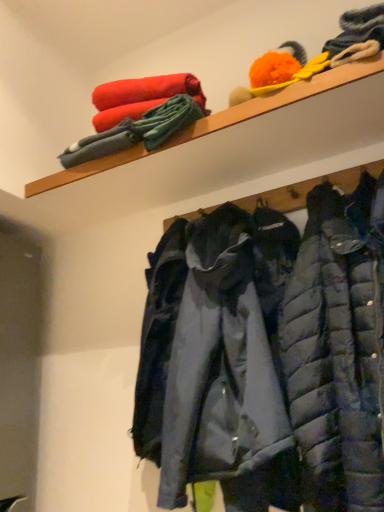
Question: Looking at their shapes, would you say wooden shelf at upper center is wider or thinner than dark blue quilted jacket at center?

Choices:
 (A) wide
 (B) thin

Answer: (B)

Question: Does point (256, 98) appear closer or farther from the camera than point (203, 305)?

Choices:
 (A) closer
 (B) farther

Answer: (B)

Question: From a real-world perspective, relative to dark blue quilted jacket at center, is wooden shelf at upper center vertically above or below?

Choices:
 (A) above
 (B) below

Answer: (A)

Question: Is dark blue quilted jacket at center inside the boundaries of wooden shelf at upper center, or outside?

Choices:
 (A) inside
 (B) outside

Answer: (B)

Question: Looking at their shapes, would you say dark blue quilted jacket at center is wider or thinner than wooden shelf at upper center?

Choices:
 (A) wide
 (B) thin

Answer: (A)

Question: Considering the positions of dark blue quilted jacket at center and wooden shelf at upper center in the image, is dark blue quilted jacket at center taller or shorter than wooden shelf at upper center?

Choices:
 (A) tall
 (B) short

Answer: (A)

Question: Would you say dark blue quilted jacket at center is to the left or to the right of wooden shelf at upper center in the picture?

Choices:
 (A) left
 (B) right

Answer: (B)